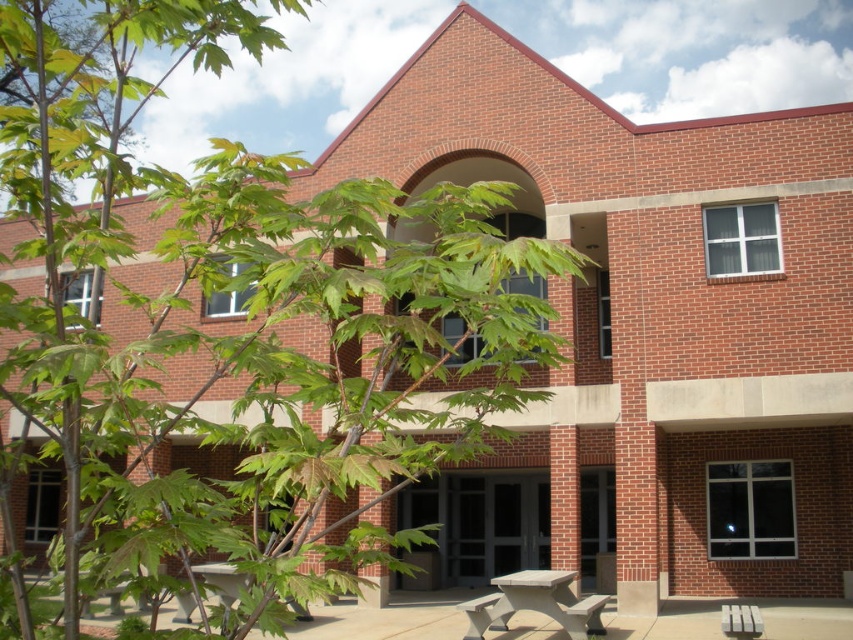
Question: Can you confirm if concrete bench at lower center is positioned below smooth gray bench at lower center?

Choices:
 (A) yes
 (B) no

Answer: (B)

Question: Is green leafy tree at center above smooth gray bench at lower center?

Choices:
 (A) yes
 (B) no

Answer: (A)

Question: Among these points, which one is nearest to the camera?

Choices:
 (A) (753, 605)
 (B) (570, 620)
 (C) (155, 515)
 (D) (480, 611)

Answer: (C)

Question: Estimate the real-world distances between objects in this image. Which object is farther from the concrete bench at lower center?

Choices:
 (A) wooden bench at lower center
 (B) green leafy tree at center

Answer: (B)

Question: Which point is farther from the camera taking this photo?

Choices:
 (A) (88, 134)
 (B) (584, 616)
 (C) (561, 576)
 (D) (747, 621)

Answer: (C)

Question: Is wooden bench at lower center thinner than white plastic park bench at lower right?

Choices:
 (A) no
 (B) yes

Answer: (B)